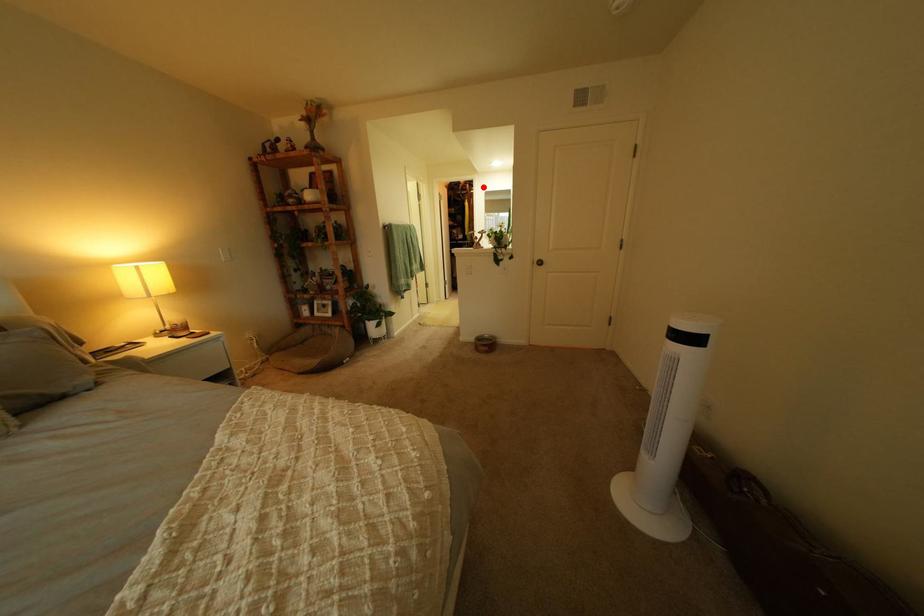
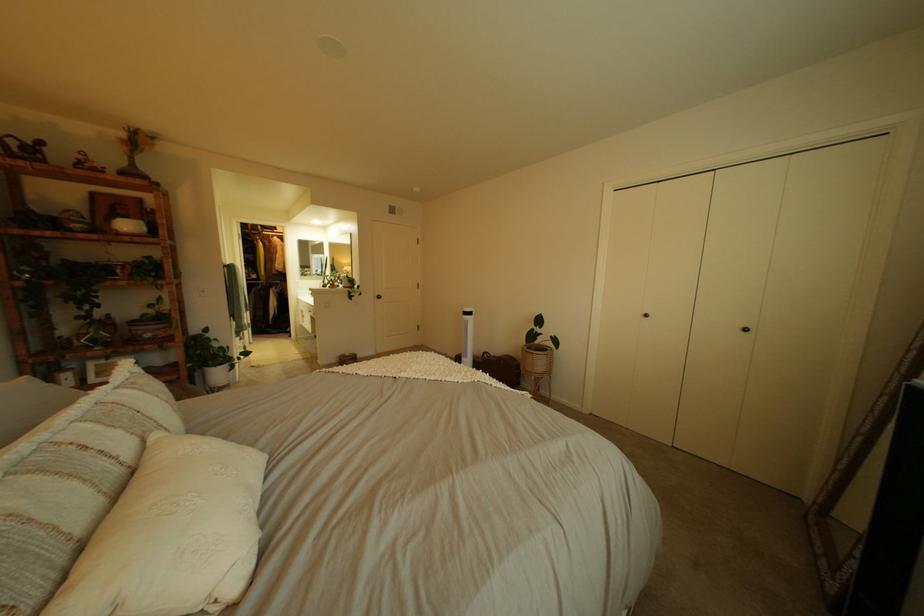
Question: I am providing you with two images of the same scene from different viewpoints. Image1 has a red point marked. In image2, the corresponding 3D location appears at what relative position? Reply with the corresponding letter.

Choices:
 (A) Closer
 (B) Farther

Answer: (B)